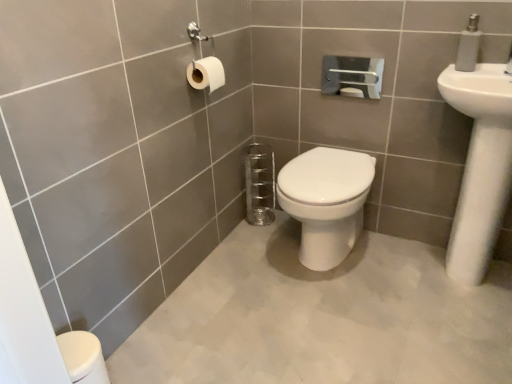
Question: From the image's perspective, is white plastic soap dispenser at upper right beneath white glossy toilet at center?

Choices:
 (A) no
 (B) yes

Answer: (A)

Question: Can you confirm if white plastic soap dispenser at upper right is wider than white glossy toilet at center?

Choices:
 (A) yes
 (B) no

Answer: (B)

Question: Is white plastic soap dispenser at upper right aimed at white glossy toilet at center?

Choices:
 (A) no
 (B) yes

Answer: (A)

Question: Is white plastic soap dispenser at upper right not near white glossy toilet at center?

Choices:
 (A) no
 (B) yes

Answer: (A)

Question: Is white plastic soap dispenser at upper right shorter than white glossy toilet at center?

Choices:
 (A) no
 (B) yes

Answer: (B)

Question: From a real-world perspective, is white matte toilet paper at upper left physically located above or below white glossy toilet at center?

Choices:
 (A) below
 (B) above

Answer: (B)

Question: Visually, is white matte toilet paper at upper left positioned to the left or to the right of white glossy toilet at center?

Choices:
 (A) left
 (B) right

Answer: (A)

Question: Considering the positions of point (208, 79) and point (308, 175), is point (208, 79) closer or farther from the camera than point (308, 175)?

Choices:
 (A) farther
 (B) closer

Answer: (B)

Question: Is white matte toilet paper at upper left inside the boundaries of white glossy toilet at center, or outside?

Choices:
 (A) outside
 (B) inside

Answer: (A)

Question: Is white glossy sink at upper right taller or shorter than white glossy toilet at center?

Choices:
 (A) short
 (B) tall

Answer: (B)

Question: Based on their positions, is white glossy sink at upper right located to the left or right of white glossy toilet at center?

Choices:
 (A) right
 (B) left

Answer: (A)

Question: Is point (477, 249) closer or farther from the camera than point (315, 249)?

Choices:
 (A) farther
 (B) closer

Answer: (B)

Question: Is white glossy sink at upper right inside the boundaries of white glossy toilet at center, or outside?

Choices:
 (A) outside
 (B) inside

Answer: (A)

Question: Is point (474, 54) positioned closer to the camera than point (510, 145)?

Choices:
 (A) farther
 (B) closer

Answer: (A)

Question: Relative to white glossy sink at upper right, is white plastic soap dispenser at upper right in front or behind?

Choices:
 (A) front
 (B) behind

Answer: (B)